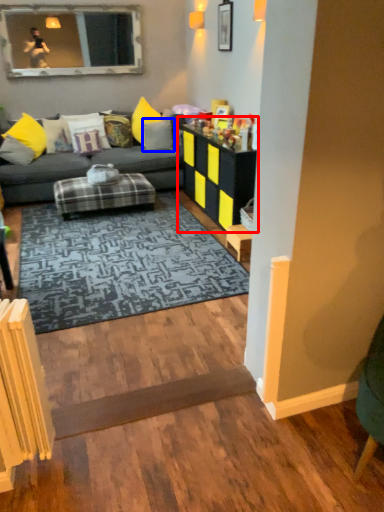
Question: Among these objects, which one is nearest to the camera, table (highlighted by a red box) or pillow (highlighted by a blue box)?

Choices:
 (A) table
 (B) pillow

Answer: (A)